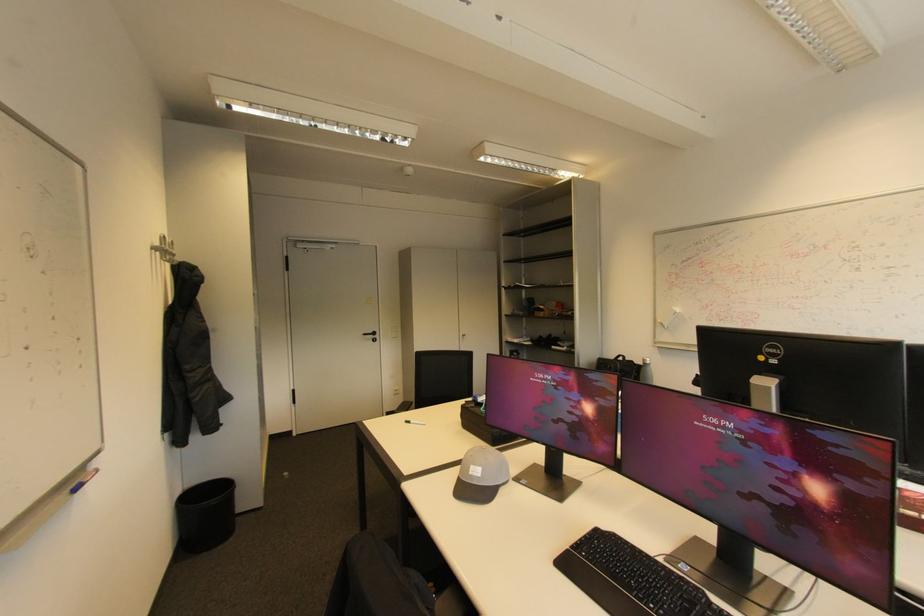
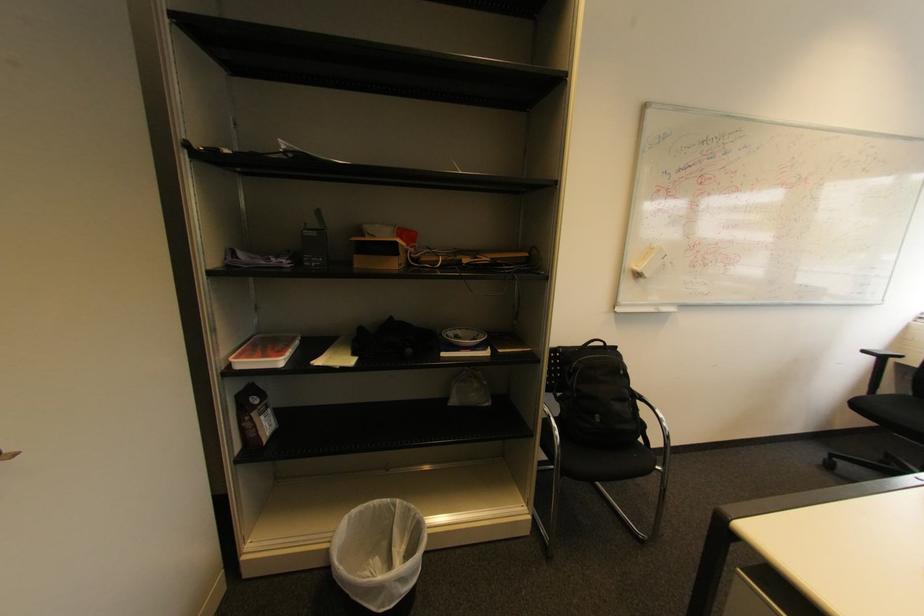
The point at (667, 325) is marked in the first image. Where is the corresponding point in the second image?

(643, 276)